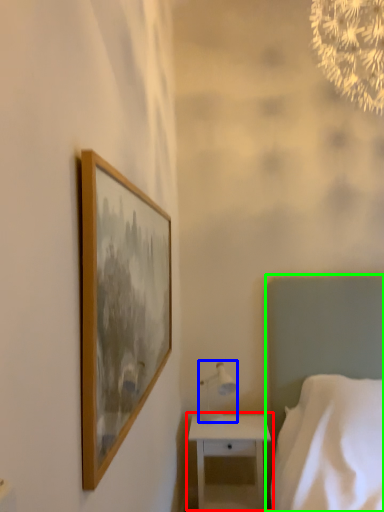
Question: Based on their relative distances, which object is farther from nightstand (highlighted by a red box)? Choose from table lamp (highlighted by a blue box) and bed (highlighted by a green box).

Choices:
 (A) table lamp
 (B) bed

Answer: (B)